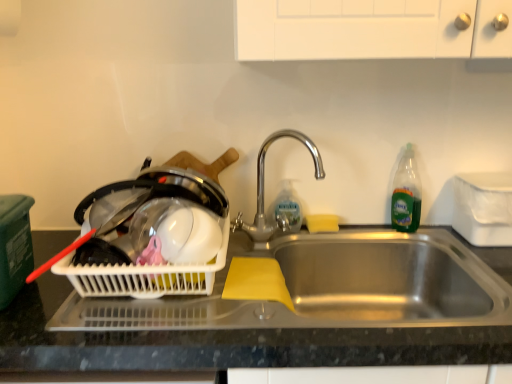
What is the approximate width of polished metal faucet at center?

8.77 inches.

Locate an element on the screen. white plastic basket at left is located at coordinates (151, 236).

Image resolution: width=512 pixels, height=384 pixels. What do you see at coordinates (406, 194) in the screenshot?
I see `green translucent bottle at right, which is the second bottle from left to right` at bounding box center [406, 194].

Measure the distance between point (273, 214) and camera.

The distance of point (273, 214) from camera is 4.26 feet.

The image size is (512, 384). What do you see at coordinates (322, 223) in the screenshot?
I see `yellow sponge at sink` at bounding box center [322, 223].

Image resolution: width=512 pixels, height=384 pixels. In order to click on polished metal faucet at center in this screenshot , I will do `click(263, 189)`.

Could you tell me if clear plastic bottle at sink, which is the second bottle from right to left, is turned towards green translucent bottle at right, the 1th bottle when ordered from right to left?

No, clear plastic bottle at sink, which is the second bottle from right to left, is not aimed at green translucent bottle at right, the 1th bottle when ordered from right to left.

Between clear plastic bottle at sink, which ranks as the first bottle in left-to-right order, and green translucent bottle at right, the 1th bottle when ordered from right to left, which one is positioned behind?

clear plastic bottle at sink, which ranks as the first bottle in left-to-right order, is further away from the camera.

Does clear plastic bottle at sink, which is the second bottle from right to left, have a greater width compared to green translucent bottle at right, the 1th bottle when ordered from right to left?

No.

Considering the relative sizes of clear plastic bottle at sink, which ranks as the first bottle in left-to-right order, and white plastic basket at left in the image provided, is clear plastic bottle at sink, which ranks as the first bottle in left-to-right order, shorter than white plastic basket at left?

In fact, clear plastic bottle at sink, which ranks as the first bottle in left-to-right order, may be taller than white plastic basket at left.

Can you confirm if clear plastic bottle at sink, which ranks as the first bottle in left-to-right order, is wider than white plastic basket at left?

Incorrect, the width of clear plastic bottle at sink, which ranks as the first bottle in left-to-right order, does not surpass that of white plastic basket at left.

Which object is further away from the camera taking this photo, clear plastic bottle at sink, which ranks as the first bottle in left-to-right order, or polished metal faucet at center?

clear plastic bottle at sink, which ranks as the first bottle in left-to-right order, is further from the camera.

From the image's perspective, which is below, clear plastic bottle at sink, which is the second bottle from right to left, or polished metal faucet at center?

clear plastic bottle at sink, which is the second bottle from right to left, is shown below in the image.

From a real-world perspective, between clear plastic bottle at sink, which is the second bottle from right to left, and polished metal faucet at center, who is vertically higher?

polished metal faucet at center is physically above.

Is point (403, 212) less distant than point (274, 208)?

Yes.

Which object is positioned more to the right, green translucent bottle at right, which is the second bottle from left to right, or clear plastic bottle at sink, which ranks as the first bottle in left-to-right order?

green translucent bottle at right, which is the second bottle from left to right.

Could clear plastic bottle at sink, which is the second bottle from right to left, be considered to be inside green translucent bottle at right, the 1th bottle when ordered from right to left?

Actually, clear plastic bottle at sink, which is the second bottle from right to left, is outside green translucent bottle at right, the 1th bottle when ordered from right to left.

Is green translucent bottle at right, which is the second bottle from left to right, wider than clear plastic bottle at sink, which is the second bottle from right to left?

Correct, the width of green translucent bottle at right, which is the second bottle from left to right, exceeds that of clear plastic bottle at sink, which is the second bottle from right to left.

Is white plastic container at right facing away from green translucent bottle at right, which is the second bottle from left to right?

No, white plastic container at right is not facing away from green translucent bottle at right, which is the second bottle from left to right.

Can green translucent bottle at right, the 1th bottle when ordered from right to left, be found inside white plastic container at right?

No.

Relative to green translucent bottle at right, which is the second bottle from left to right, is white plastic container at right in front or behind?

white plastic container at right is positioned closer to the viewer than green translucent bottle at right, which is the second bottle from left to right.

Based on the photo, does white plastic container at right have a greater width compared to green translucent bottle at right, the 1th bottle when ordered from right to left?

Yes.

Considering the relative sizes of clear plastic bottle at sink, which is the second bottle from right to left, and white plastic container at right in the image provided, is clear plastic bottle at sink, which is the second bottle from right to left, shorter than white plastic container at right?

Indeed, clear plastic bottle at sink, which is the second bottle from right to left, has a lesser height compared to white plastic container at right.

Identify the location of appliance located below the clear plastic bottle at sink, which ranks as the first bottle in left-to-right order (from the image's perspective). This screenshot has width=512, height=384. (483, 208).

Could you tell me if clear plastic bottle at sink, which ranks as the first bottle in left-to-right order, is turned towards white plastic container at right?

No, clear plastic bottle at sink, which ranks as the first bottle in left-to-right order, does not turn towards white plastic container at right.

How many degrees apart are the facing directions of clear plastic bottle at sink, which is the second bottle from right to left, and white plastic container at right?

There is a 0.00384-degree angle between the facing directions of clear plastic bottle at sink, which is the second bottle from right to left, and white plastic container at right.

Is white plastic basket at left wider than stainless steel sink at center?

No.

From the image's perspective, relative to stainless steel sink at center, is white plastic basket at left above or below?

Clearly, from the image's perspective, white plastic basket at left is above stainless steel sink at center.

Looking at this image, considering the sizes of objects white plastic basket at left and stainless steel sink at center in the image provided, who is bigger, white plastic basket at left or stainless steel sink at center?

stainless steel sink at center.

Where is `basket container on the left of stainless steel sink at center`? The height and width of the screenshot is (384, 512). basket container on the left of stainless steel sink at center is located at coordinates (151, 236).

The width and height of the screenshot is (512, 384). I want to click on bottle located below the green translucent bottle at right, the 1th bottle when ordered from right to left (from the image's perspective), so click(x=288, y=206).

In order to click on bottle that is the 1st one above the white plastic basket at left (from a real-world perspective) in this screenshot , I will do `click(288, 206)`.

Based on their spatial positions, is white plastic basket at left or polished metal faucet at center further from clear plastic bottle at sink, which ranks as the first bottle in left-to-right order?

Among the two, white plastic basket at left is located further to clear plastic bottle at sink, which ranks as the first bottle in left-to-right order.

Based on their spatial positions, is white plastic basket at left or clear plastic bottle at sink, which is the second bottle from right to left, further from green translucent bottle at right, which is the second bottle from left to right?

Based on the image, white plastic basket at left appears to be further to green translucent bottle at right, which is the second bottle from left to right.

When comparing their distances from polished metal faucet at center, does yellow sponge at sink or white plastic container at right seem further?

white plastic container at right lies further to polished metal faucet at center than the other object.

Which object lies further to the anchor point clear plastic bottle at sink, which is the second bottle from right to left, stainless steel sink at center or polished metal faucet at center?

stainless steel sink at center.

In the scene shown: Considering their positions, is yellow sponge at sink positioned further to green translucent bottle at right, the 1th bottle when ordered from right to left, than polished metal faucet at center?

polished metal faucet at center lies further to green translucent bottle at right, the 1th bottle when ordered from right to left, than the other object.

From the image, which object appears to be nearer to green translucent bottle at right, which is the second bottle from left to right, clear plastic bottle at sink, which ranks as the first bottle in left-to-right order, or yellow sponge at sink?

yellow sponge at sink is closer to green translucent bottle at right, which is the second bottle from left to right.

From the image, which object appears to be farther from yellow sponge at sink, white plastic container at right or white plastic basket at left?

white plastic basket at left is positioned further to the anchor yellow sponge at sink.

Considering their positions, is green translucent bottle at right, the 1th bottle when ordered from right to left, positioned further to polished metal faucet at center than stainless steel sink at center?

green translucent bottle at right, the 1th bottle when ordered from right to left, lies further to polished metal faucet at center than the other object.

I want to click on bottle between white plastic basket at left and green translucent bottle at right, the 1th bottle when ordered from right to left, in the horizontal direction, so click(x=288, y=206).

The height and width of the screenshot is (384, 512). In order to click on sink between polished metal faucet at center and white plastic container at right from left to right in this screenshot , I will do tap(385, 279).

At what (x,y) coordinates should I click in order to perform the action: click on tap between green translucent bottle at right, which is the second bottle from left to right, and stainless steel sink at center from top to bottom. Please return your answer as a coordinate pair (x, y). The image size is (512, 384). Looking at the image, I should click on (263, 189).

Image resolution: width=512 pixels, height=384 pixels. I want to click on sink between white plastic basket at left and white plastic container at right, so click(385, 279).